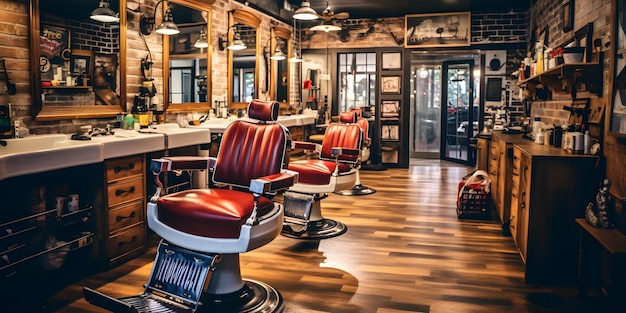
I want to click on sink, so click(14, 144).